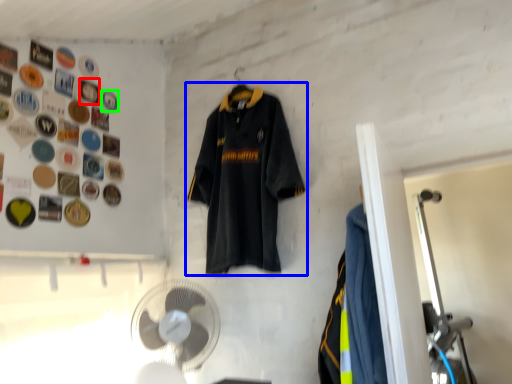
Question: Considering the real-world distances, which object is farthest from button (highlighted by a red box)? sports uniform (highlighted by a blue box) or button (highlighted by a green box)?

Choices:
 (A) sports uniform
 (B) button

Answer: (A)